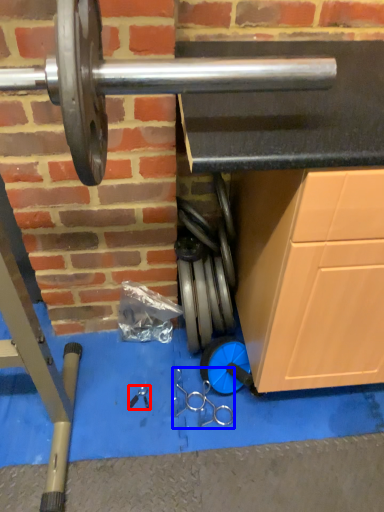
Question: Among these objects, which one is farthest to the camera, tool (highlighted by a red box) or tool (highlighted by a blue box)?

Choices:
 (A) tool
 (B) tool

Answer: (A)